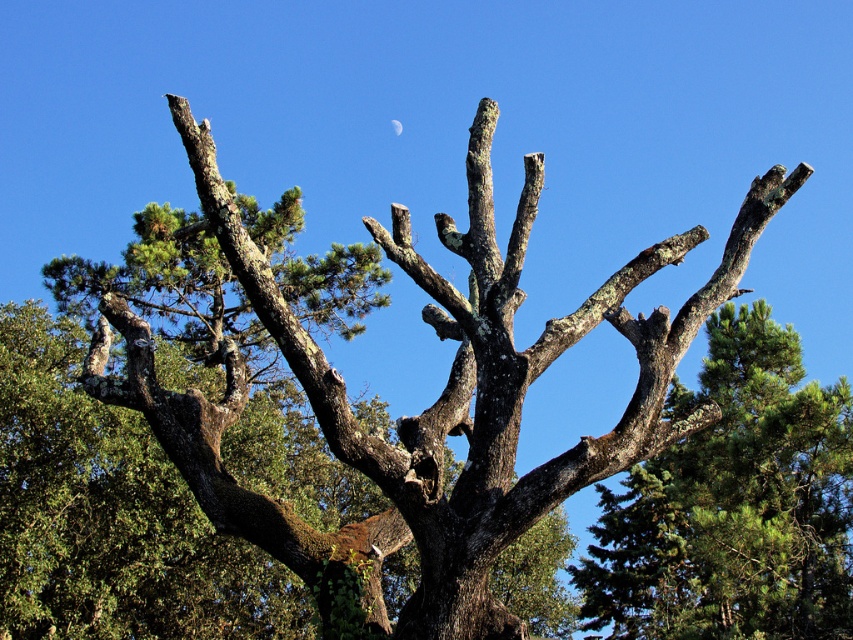
You are an astronomer observing the sky through a telescope. You notice the green mossy branch at center and the silver metallic moon at upper center in your view. Which object is closer to your telescope?

The green mossy branch at center is much taller than the silver metallic moon at upper center, so it is closer to the telescope.

You are an artist trying to paint the scene. You want to ensure the green mossy branch at center and the silver metallic moon at upper center are proportionally accurate. Which object should you draw wider in your painting?

The green mossy branch at center should be drawn wider than the silver metallic moon at upper center because its width is larger according to the description.

You are an astronomer observing the sky through a telescope. You notice the green mossy branch at center and the silver metallic moon at upper center in your view. Which object would block your view of the other if they are aligned along the same line of sight?

The green mossy branch at center would block the view of the silver metallic moon at upper center because it is closer to the viewer.